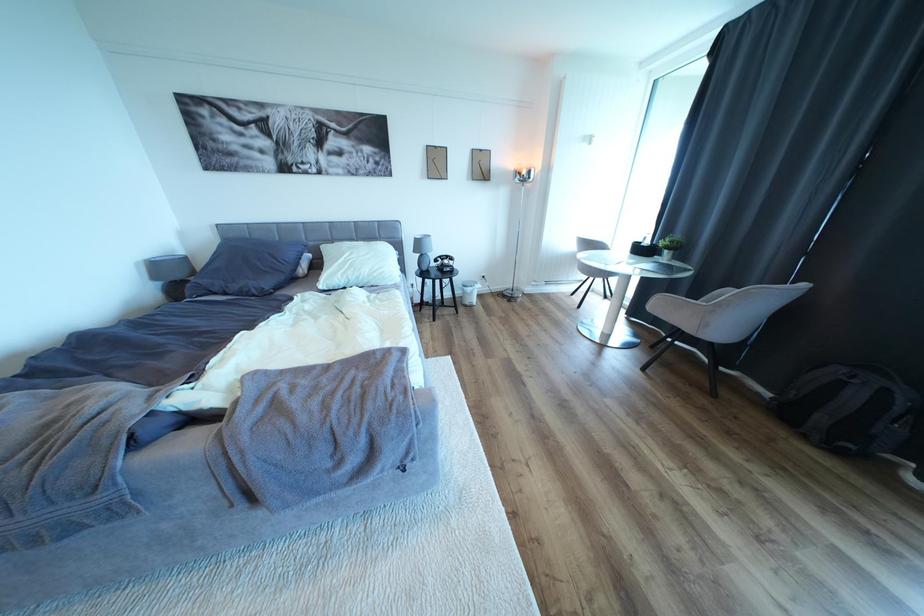
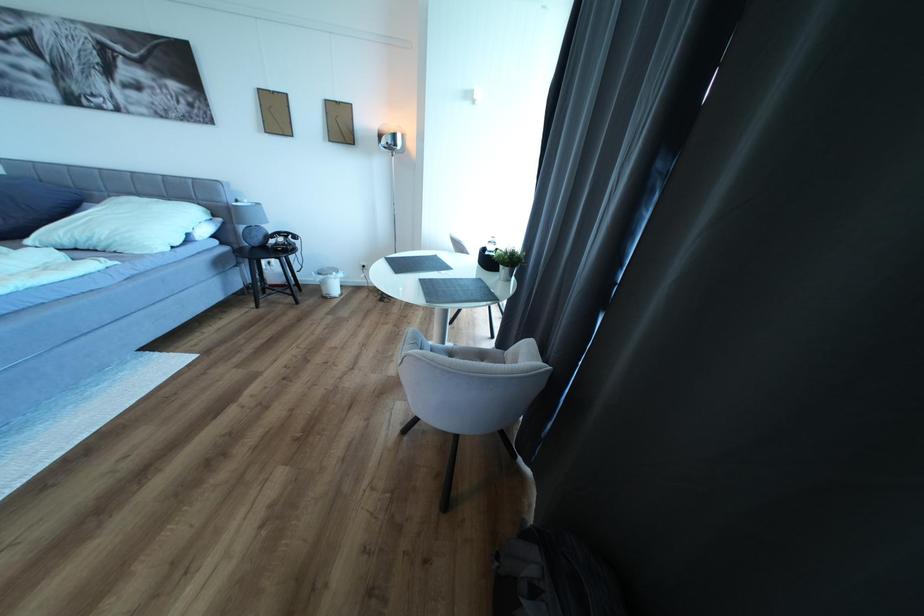
What movement of the cameraman would produce the second image?

The movement direction of the cameraman is right, forward.